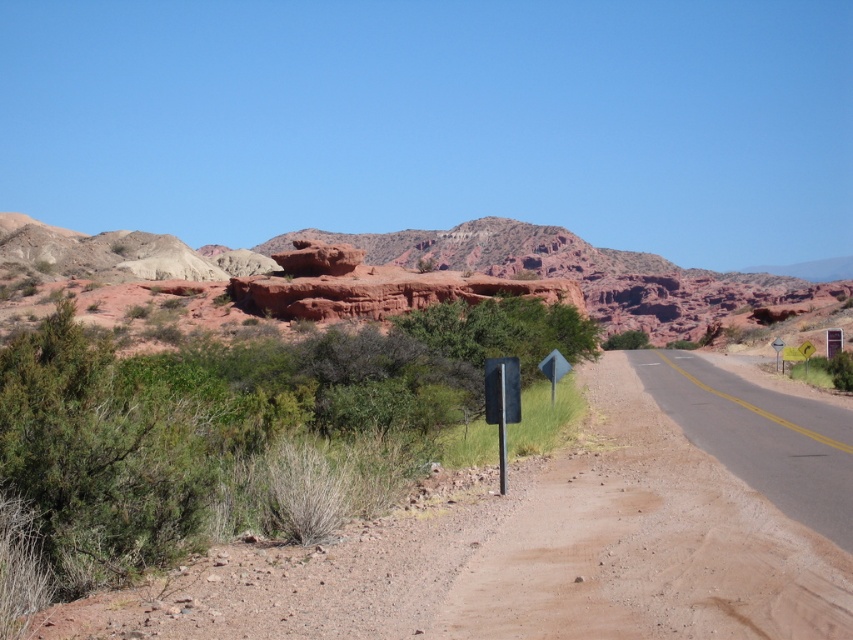
Question: Among these points, which one is nearest to the camera?

Choices:
 (A) (399, 268)
 (B) (778, 342)

Answer: (B)

Question: In this image, where is black metal sign at center located relative to metallic triangular sign at right?

Choices:
 (A) right
 (B) left

Answer: (B)

Question: Which object is closer to the camera taking this photo?

Choices:
 (A) metallic triangular sign at right
 (B) reddish rock formation at center

Answer: (A)

Question: Which object is positioned closest to the brown gravel dirt track at center?

Choices:
 (A) black metal sign at center
 (B) metallic triangular sign at right

Answer: (A)

Question: Does brown gravel dirt track at center have a larger size compared to black metal sign at center?

Choices:
 (A) no
 (B) yes

Answer: (B)

Question: Is black metal sign at center to the right of metallic triangular sign at right from the viewer's perspective?

Choices:
 (A) yes
 (B) no

Answer: (B)